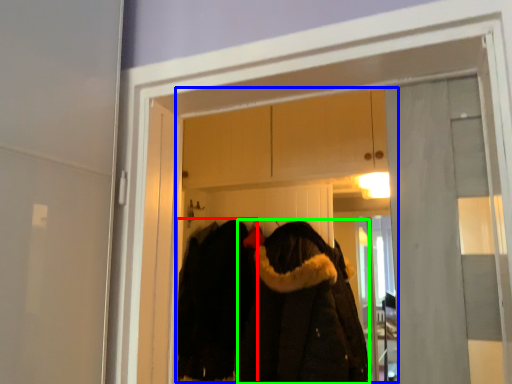
Question: Estimate the real-world distances between objects in this image. Which object is closer to cloak (highlighted by a red box), clothing store (highlighted by a blue box) or cloak (highlighted by a green box)?

Choices:
 (A) clothing store
 (B) cloak

Answer: (B)